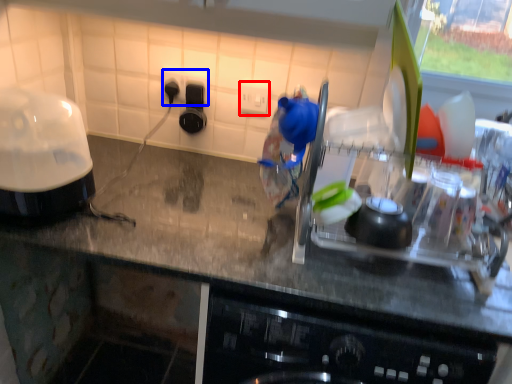
Question: Which of the following is the farthest to the observer, electric outlet (highlighted by a red box) or electric outlet (highlighted by a blue box)?

Choices:
 (A) electric outlet
 (B) electric outlet

Answer: (B)